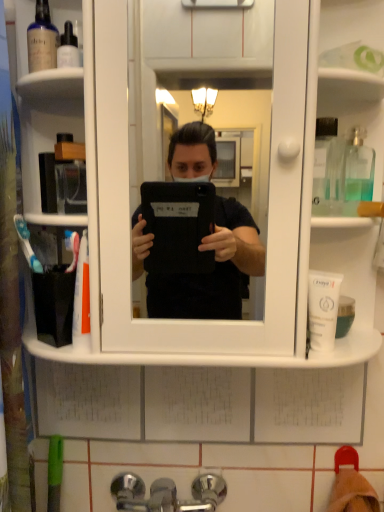
Question: Can you confirm if clear glass bottle at upper right, marked as the 1th mouthwash in a right-to-left arrangement, is smaller than chrome metallic faucet at lower center?

Choices:
 (A) yes
 (B) no

Answer: (A)

Question: Considering the relative sizes of clear glass bottle at upper right, marked as the 1th mouthwash in a right-to-left arrangement, and chrome metallic faucet at lower center in the image provided, is clear glass bottle at upper right, marked as the 1th mouthwash in a right-to-left arrangement, taller than chrome metallic faucet at lower center?

Choices:
 (A) yes
 (B) no

Answer: (B)

Question: From a real-world perspective, is clear glass bottle at upper right, marked as the 1th mouthwash in a right-to-left arrangement, under chrome metallic faucet at lower center?

Choices:
 (A) yes
 (B) no

Answer: (B)

Question: Can we say clear glass bottle at upper right, the second mouthwash in the bottom-to-top sequence, lies outside chrome metallic faucet at lower center?

Choices:
 (A) no
 (B) yes

Answer: (B)

Question: Is the position of clear glass bottle at upper right, marked as the 1th mouthwash in a right-to-left arrangement, less distant than that of chrome metallic faucet at lower center?

Choices:
 (A) no
 (B) yes

Answer: (A)

Question: Considering the positions of point (317, 315) and point (349, 147), is point (317, 315) closer or farther from the camera than point (349, 147)?

Choices:
 (A) closer
 (B) farther

Answer: (A)

Question: Would you say white matte tube at right, the third mouthwash positioned from the top, is to the left or to the right of clear glass bottle at upper right, the second mouthwash in the bottom-to-top sequence, in the picture?

Choices:
 (A) right
 (B) left

Answer: (B)

Question: In the image, is white matte tube at right, acting as the 2th mouthwash starting from the left, positioned in front of or behind clear glass bottle at upper right, the 3th mouthwash viewed from the left?

Choices:
 (A) behind
 (B) front

Answer: (B)

Question: In terms of size, does white matte tube at right, which appears as the 2th mouthwash when viewed from the right, appear bigger or smaller than clear glass bottle at upper right, the second mouthwash in the bottom-to-top sequence?

Choices:
 (A) big
 (B) small

Answer: (A)

Question: Considering the positions of translucent glass mouthwash at upper left, which appears as the first mouthwash when viewed from the left, and clear glass bottle at upper right, the 3th mouthwash viewed from the left, in the image, is translucent glass mouthwash at upper left, which appears as the first mouthwash when viewed from the left, wider or thinner than clear glass bottle at upper right, the 3th mouthwash viewed from the left,?

Choices:
 (A) wide
 (B) thin

Answer: (B)

Question: From a real-world perspective, is translucent glass mouthwash at upper left, which is the 1th mouthwash in top-to-bottom order, positioned above or below clear glass bottle at upper right, marked as the 1th mouthwash in a right-to-left arrangement?

Choices:
 (A) below
 (B) above

Answer: (B)

Question: Is translucent glass mouthwash at upper left, the 3th mouthwash positioned from the right, taller or shorter than clear glass bottle at upper right, the second mouthwash in the bottom-to-top sequence?

Choices:
 (A) short
 (B) tall

Answer: (B)

Question: Is translucent glass mouthwash at upper left, which is the 1th mouthwash in top-to-bottom order, inside or outside of clear glass bottle at upper right, marked as the 1th mouthwash in a right-to-left arrangement?

Choices:
 (A) outside
 (B) inside

Answer: (A)

Question: Is clear glass bottle at upper right, marked as the 1th mouthwash in a right-to-left arrangement, wider or thinner than white matte tube at right, marked as the 1th mouthwash in a bottom-to-top arrangement?

Choices:
 (A) thin
 (B) wide

Answer: (A)

Question: Based on their sizes in the image, would you say clear glass bottle at upper right, the second mouthwash in the bottom-to-top sequence, is bigger or smaller than white matte tube at right, acting as the 2th mouthwash starting from the left?

Choices:
 (A) big
 (B) small

Answer: (B)